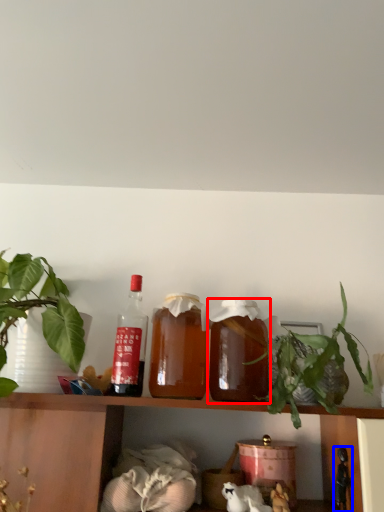
Question: Which object appears farthest to the camera in this image, bottle (highlighted by a red box) or toy (highlighted by a blue box)?

Choices:
 (A) bottle
 (B) toy

Answer: (A)